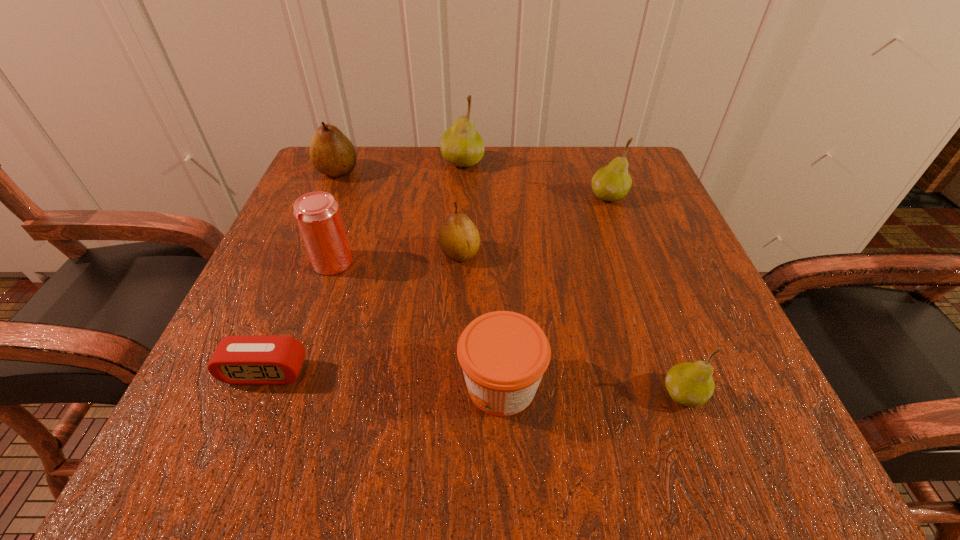
Locate an element on the screen. This screenshot has height=540, width=960. object present at the near right corner is located at coordinates (690, 384).

Find the location of `vacant space at the far edge of the desktop`. vacant space at the far edge of the desktop is located at coordinates (393, 181).

At what (x,y) coordinates should I click in order to perform the action: click on vacant region at the near edge. Please return your answer as a coordinate pair (x, y). This screenshot has width=960, height=540. Looking at the image, I should click on (473, 418).

You are a GUI agent. You are given a task and a screenshot of the screen. Output one action in this format:
    pyautogui.click(x=<x>, y=<y>)
    Task: Click on the vacant region at the left edge
    The width and height of the screenshot is (960, 540).
    Given the screenshot: What is the action you would take?
    pyautogui.click(x=247, y=301)

This screenshot has height=540, width=960. In the image, there is a desktop. Find the location of `vacant space at the right edge`. vacant space at the right edge is located at coordinates (669, 324).

The height and width of the screenshot is (540, 960). Find the location of `vacant space at the near left corner of the desktop`. vacant space at the near left corner of the desktop is located at coordinates (287, 454).

Where is `vacant space at the far right corner`? The image size is (960, 540). vacant space at the far right corner is located at coordinates (646, 205).

Identify the location of free location at the near right corner. Image resolution: width=960 pixels, height=540 pixels. (701, 458).

The image size is (960, 540). I want to click on free space between the beer can and the jam, so click(x=417, y=324).

The width and height of the screenshot is (960, 540). In order to click on free spot between the farthest green pear and the pink alarm clock in this screenshot , I will do `click(364, 267)`.